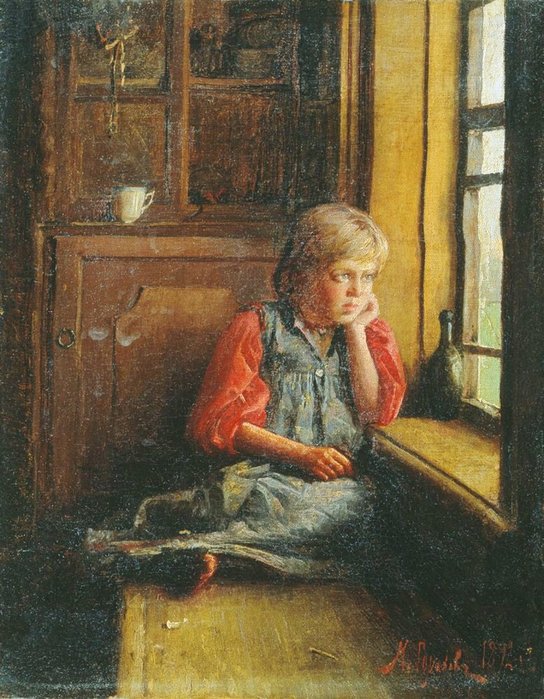
The image size is (544, 699). Identify the location of wooden cabinet door. (107, 281).